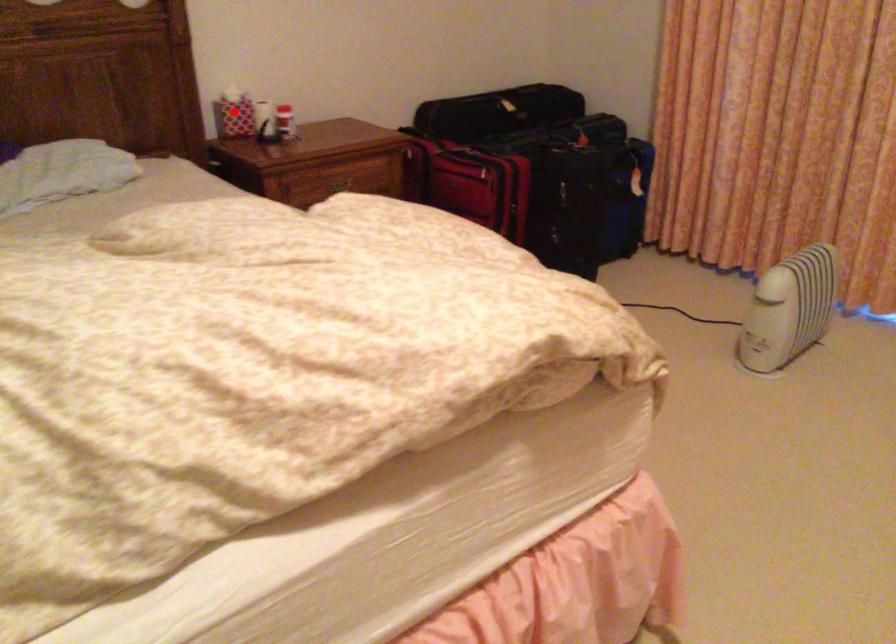
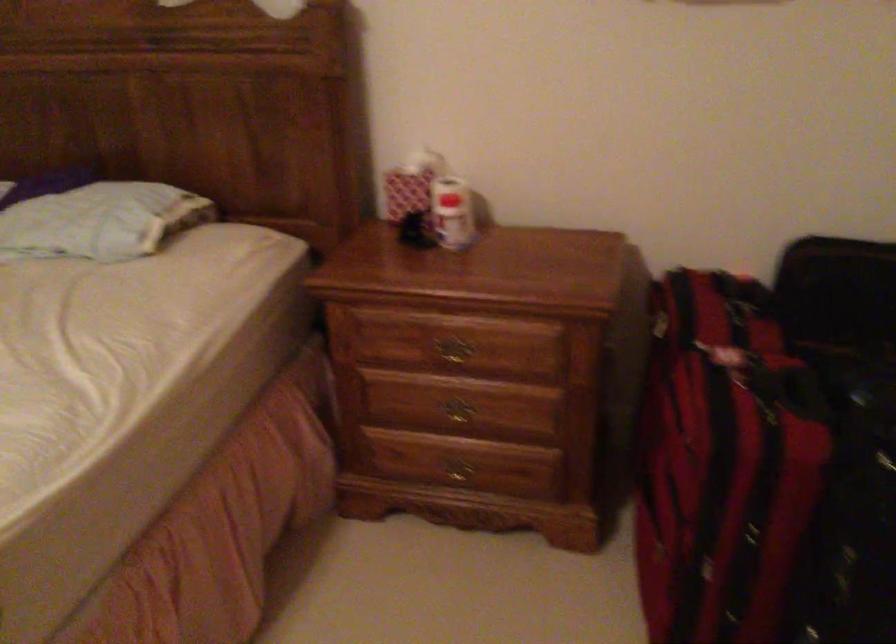
Question: I am providing you with two images of the same scene from different viewpoints. In image1, a red point is highlighted. Considering the same 3D point in image2, which of the following is correct?

Choices:
 (A) It is closer
 (B) It is farther

Answer: (A)